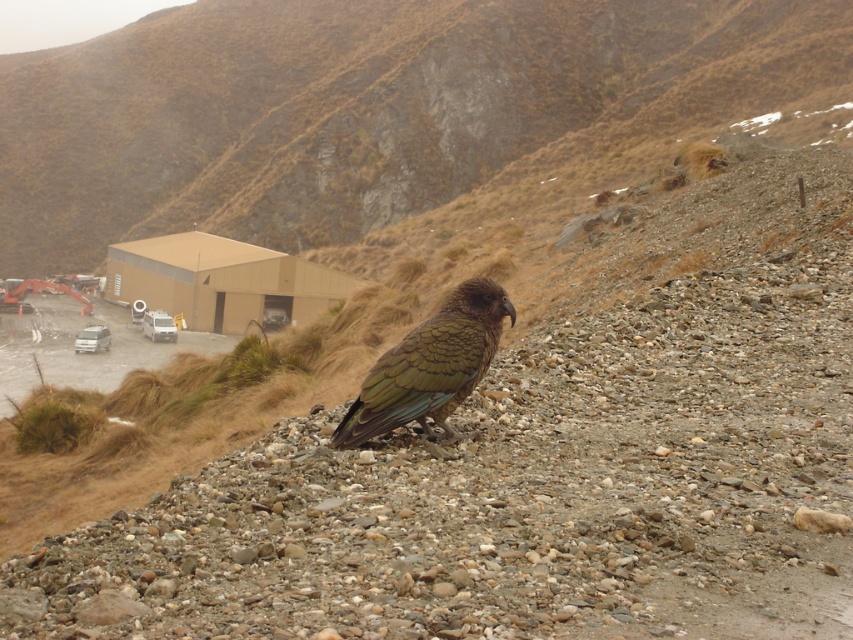
Who is more forward, [421,326] or [85,333]?

Positioned in front is point [421,326].

Identify the location of green feathered bird at center. The image size is (853, 640). (428, 365).

Is point (422, 362) positioned in front of point (91, 346)?

Yes, it is.

Where is `green feathered bird at center`? Image resolution: width=853 pixels, height=640 pixels. green feathered bird at center is located at coordinates (428, 365).

Does brown grassy hillside at upper center come behind green feathered bird at center?

Yes.

From the picture: Does brown grassy hillside at upper center have a lesser width compared to green feathered bird at center?

Incorrect, brown grassy hillside at upper center's width is not less than green feathered bird at center's.

Between point (773, 88) and point (451, 355), which one is positioned behind?

Point (773, 88)

Locate an element on the screen. Image resolution: width=853 pixels, height=640 pixels. brown grassy hillside at upper center is located at coordinates (364, 108).

What do you see at coordinates (514, 493) in the screenshot?
I see `brown gravel at center` at bounding box center [514, 493].

Which is more to the left, brown gravel at center or green feathered bird at center?

From the viewer's perspective, brown gravel at center appears more on the left side.

Find the location of a particular element. brown gravel at center is located at coordinates (514, 493).